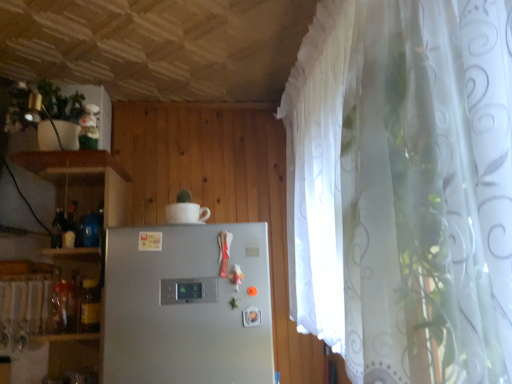
Measure the distance between satin silver refrigerator at center and camera.

Answer: 1.42 meters.

Describe the element at coordinates (186, 306) in the screenshot. I see `satin silver refrigerator at center` at that location.

This screenshot has height=384, width=512. Find the location of `satin silver refrigerator at center`. satin silver refrigerator at center is located at coordinates (186, 306).

What do you see at coordinates (186, 213) in the screenshot? The height and width of the screenshot is (384, 512). I see `white glossy cup at upper center` at bounding box center [186, 213].

This screenshot has height=384, width=512. I want to click on white glossy cup at upper center, so click(186, 213).

Find the location of a particular element. This screenshot has height=384, width=512. satin silver refrigerator at center is located at coordinates (186, 306).

Can you confirm if white glossy cup at upper center is positioned to the right of satin silver refrigerator at center?

No.

Relative to satin silver refrigerator at center, is white glossy cup at upper center in front or behind?

white glossy cup at upper center is behind satin silver refrigerator at center.

Considering the positions of point (186, 218) and point (270, 348), is point (186, 218) closer or farther from the camera than point (270, 348)?

Point (186, 218).

From the image's perspective, is white glossy cup at upper center located above or below satin silver refrigerator at center?

Clearly, from the image's perspective, white glossy cup at upper center is above satin silver refrigerator at center.

From a real-world perspective, is white glossy cup at upper center positioned under satin silver refrigerator at center based on gravity?

No, from a real-world perspective, white glossy cup at upper center is not under satin silver refrigerator at center.

Based on the photo, does white glossy cup at upper center have a lesser width compared to satin silver refrigerator at center?

Correct, the width of white glossy cup at upper center is less than that of satin silver refrigerator at center.

Can you confirm if white glossy cup at upper center is shorter than satin silver refrigerator at center?

Yes.

Considering the sizes of objects white glossy cup at upper center and satin silver refrigerator at center in the image provided, who is smaller, white glossy cup at upper center or satin silver refrigerator at center?

Smaller between the two is white glossy cup at upper center.

Is white glossy cup at upper center outside of satin silver refrigerator at center?

Yes.

Are white glossy cup at upper center and satin silver refrigerator at center located far from each other?

No, there isn't a large distance between white glossy cup at upper center and satin silver refrigerator at center.

Based on the photo, is white glossy cup at upper center positioned with its back to satin silver refrigerator at center?

No, white glossy cup at upper center's orientation is not away from satin silver refrigerator at center.

What's the angular difference between white glossy cup at upper center and satin silver refrigerator at center's facing directions?

white glossy cup at upper center and satin silver refrigerator at center are facing 3.08 degrees away from each other.

How distant is white glossy cup at upper center from satin silver refrigerator at center?

white glossy cup at upper center and satin silver refrigerator at center are 15.77 inches apart.

At what (x,y) coordinates should I click in order to perform the action: click on refrigerator in front of the white glossy cup at upper center. Please return your answer as a coordinate pair (x, y). The height and width of the screenshot is (384, 512). Looking at the image, I should click on (186, 306).

Based on their positions, is satin silver refrigerator at center located to the left or right of white glossy cup at upper center?

satin silver refrigerator at center is to the right of white glossy cup at upper center.

In the image, is satin silver refrigerator at center positioned in front of or behind white glossy cup at upper center?

In the image, satin silver refrigerator at center appears in front of white glossy cup at upper center.

Which is farther, (130, 381) or (202, 222)?

The point (202, 222) is farther from the camera.

From the image's perspective, relative to white glossy cup at upper center, is satin silver refrigerator at center above or below?

satin silver refrigerator at center is below white glossy cup at upper center.

Looking at this image, from a real-world perspective, does satin silver refrigerator at center sit lower than white glossy cup at upper center?

Correct, in the physical world, satin silver refrigerator at center is lower than white glossy cup at upper center.

Is satin silver refrigerator at center wider than white glossy cup at upper center?

Indeed, satin silver refrigerator at center has a greater width compared to white glossy cup at upper center.

Which of these two, satin silver refrigerator at center or white glossy cup at upper center, stands shorter?

With less height is white glossy cup at upper center.

Who is smaller, satin silver refrigerator at center or white glossy cup at upper center?

With smaller size is white glossy cup at upper center.

Is satin silver refrigerator at center surrounding white glossy cup at upper center?

No, white glossy cup at upper center is not inside satin silver refrigerator at center.

Looking at this image, is satin silver refrigerator at center in contact with white glossy cup at upper center?

No, satin silver refrigerator at center is not next to white glossy cup at upper center.

Does satin silver refrigerator at center turn towards white glossy cup at upper center?

No, satin silver refrigerator at center is not oriented towards white glossy cup at upper center.

What are the coordinates of `appliance on the left of satin silver refrigerator at center` in the screenshot? It's located at (186, 213).

You are a GUI agent. You are given a task and a screenshot of the screen. Output one action in this format:
    pyautogui.click(x=<x>, y=<y>)
    Task: Click on the refrigerator on the right of white glossy cup at upper center
    The image size is (512, 384).
    Given the screenshot: What is the action you would take?
    pyautogui.click(x=186, y=306)

Identify the location of appliance on the left of satin silver refrigerator at center. The image size is (512, 384). (186, 213).